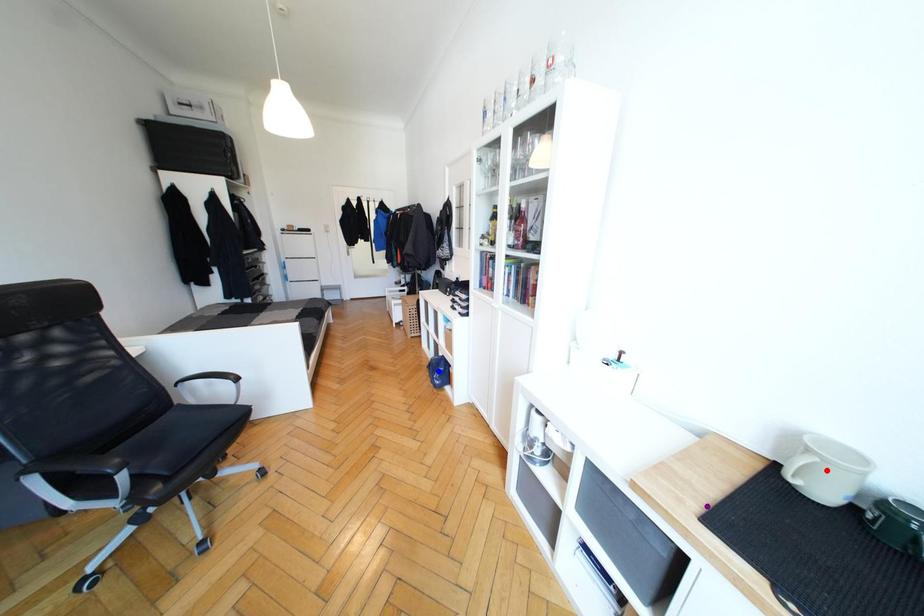
Consider the image. Order these from farthest to nearest:
purple point
red point
blue point

blue point
purple point
red point